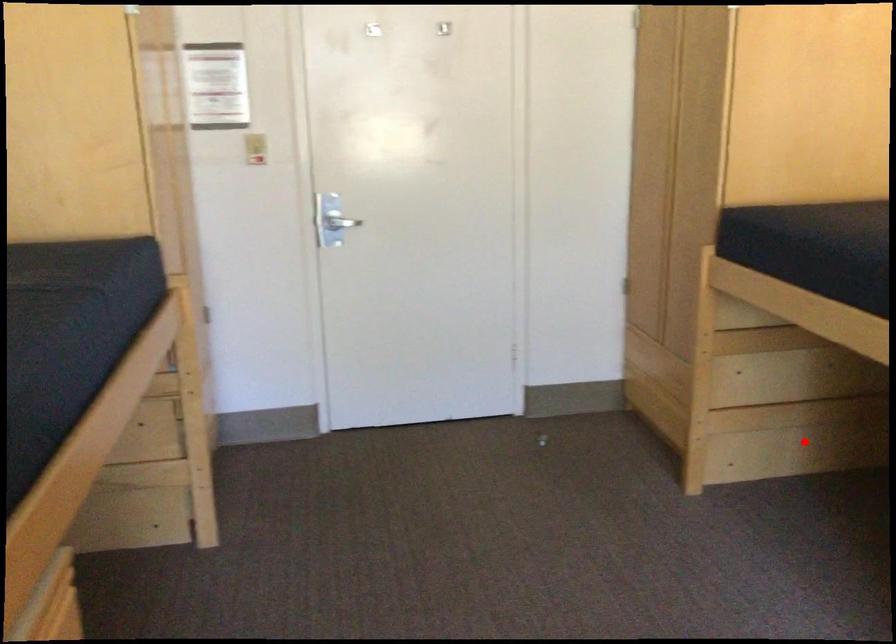
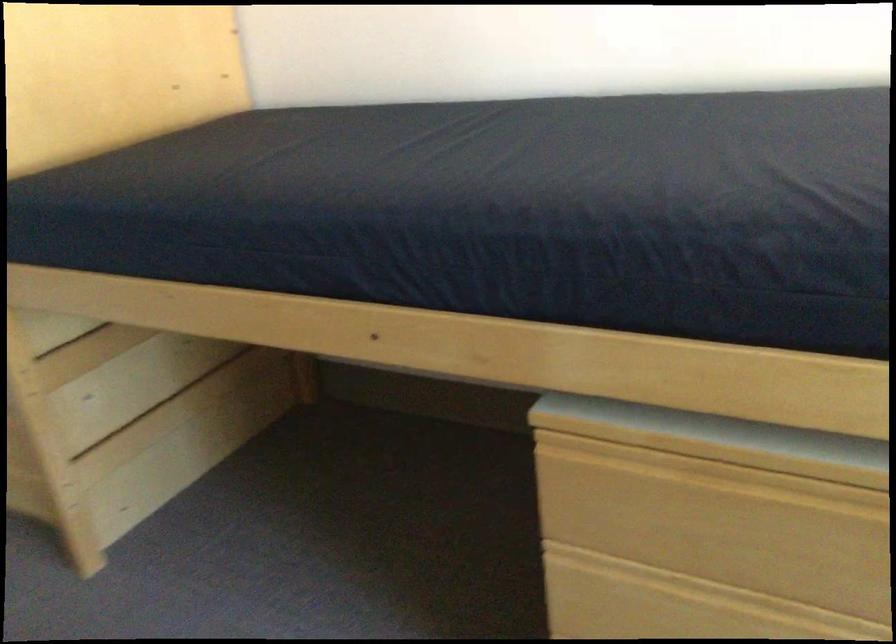
Question: A red point is marked in image1. In image2, is the corresponding 3D point closer to the camera or farther? Reply with the corresponding letter.

Choices:
 (A) The corresponding 3D point is closer.
 (B) The corresponding 3D point is farther.

Answer: (A)